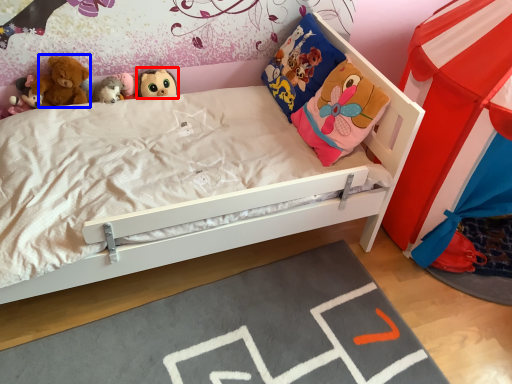
Question: Which point is closer to the camera, toy (highlighted by a red box) or doll (highlighted by a blue box)?

Choices:
 (A) toy
 (B) doll

Answer: (B)